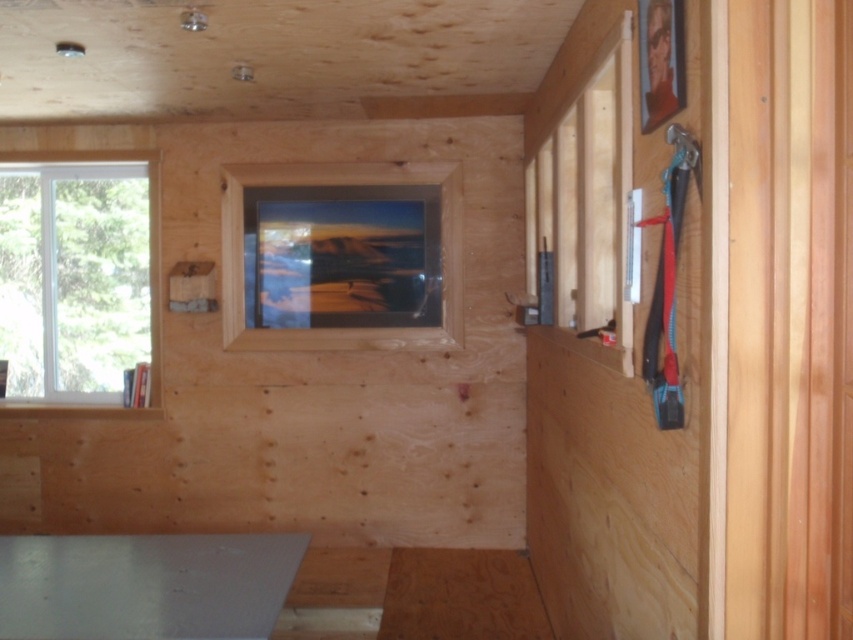
You are standing inside the wooden structure and want to place a new painting on the wall between the white plastic window at left and the matte wooden frame at center. Where should you place it to ensure it is centered between them?

The white plastic window at left is positioned on the left side of matte wooden frame at center, so the painting should be placed between them, equidistant from both the white plastic window at left and the matte wooden frame at center.